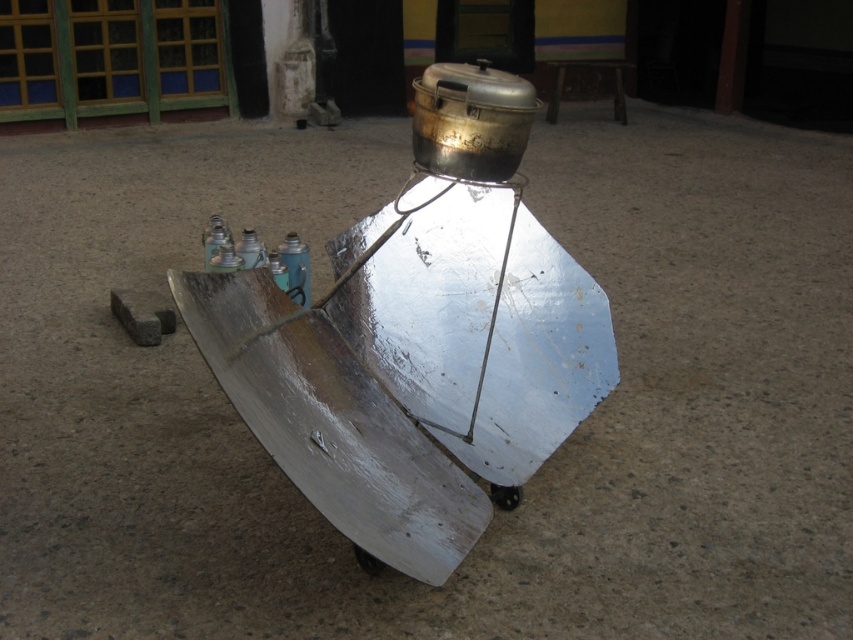
Is matte blue bottle at center closer to camera compared to brushed metal spray can at center?

No, matte blue bottle at center is further to the viewer.

Is matte blue bottle at center wider than brushed metal spray can at center?

No.

Which is in front, point (260, 266) or point (221, 268)?

Point (221, 268) is in front.

This screenshot has height=640, width=853. What are the coordinates of `matte blue bottle at center` in the screenshot? It's located at (251, 250).

Who is more forward, (234,260) or (287,278)?

Point (234,260) is in front.

Is the position of brushed metal spray can at center more distant than that of blue matte bottle at center?

No, brushed metal spray can at center is closer to the viewer.

What are the coordinates of `brushed metal spray can at center` in the screenshot? It's located at (225, 259).

Is blue plastic bottle at center to the right of brushed metal spray can at center from the viewer's perspective?

Indeed, blue plastic bottle at center is positioned on the right side of brushed metal spray can at center.

Does point (299, 264) lie behind point (225, 264)?

That is True.

What do you see at coordinates (294, 266) in the screenshot? I see `blue plastic bottle at center` at bounding box center [294, 266].

In order to click on blue plastic bottle at center in this screenshot , I will do `click(294, 266)`.